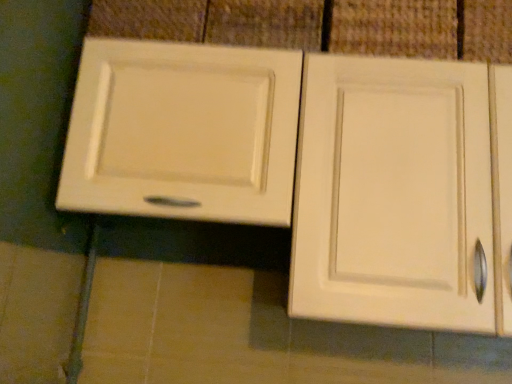
Question: Would you say matte white cabinet at upper left is to the left or to the right of white matte cabinet door at upper center in the picture?

Choices:
 (A) left
 (B) right

Answer: (A)

Question: Would you say matte white cabinet at upper left is inside or outside white matte cabinet door at upper center?

Choices:
 (A) outside
 (B) inside

Answer: (A)

Question: In terms of width, does matte white cabinet at upper left look wider or thinner when compared to white matte cabinet door at upper center?

Choices:
 (A) thin
 (B) wide

Answer: (B)

Question: From a real-world perspective, is white matte cabinet door at upper center above or below matte white cabinet at upper left?

Choices:
 (A) above
 (B) below

Answer: (A)

Question: Is white matte cabinet door at upper center to the left or to the right of matte white cabinet at upper left in the image?

Choices:
 (A) left
 (B) right

Answer: (B)

Question: In terms of height, does white matte cabinet door at upper center look taller or shorter compared to matte white cabinet at upper left?

Choices:
 (A) tall
 (B) short

Answer: (B)

Question: Considering the positions of white matte cabinet door at upper center and matte white cabinet at upper left in the image, is white matte cabinet door at upper center bigger or smaller than matte white cabinet at upper left?

Choices:
 (A) big
 (B) small

Answer: (B)